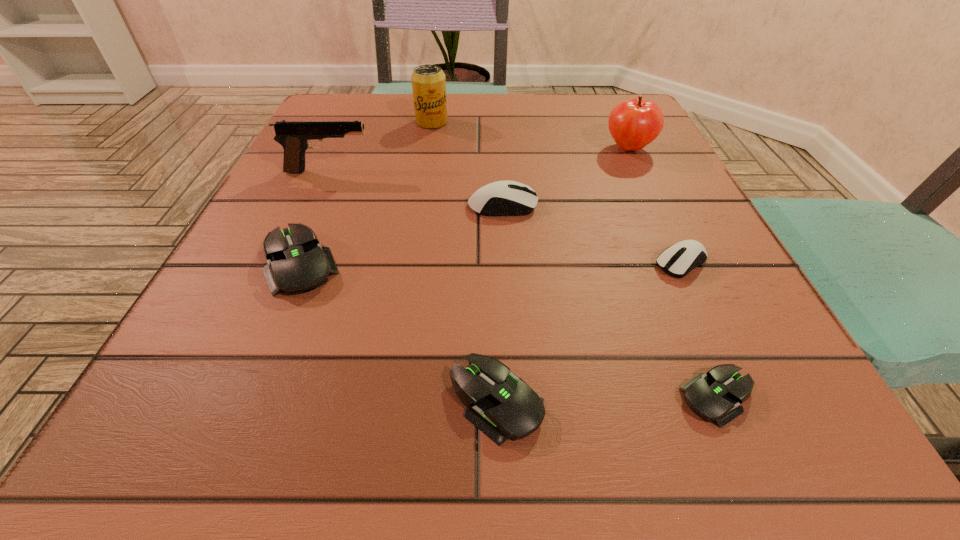
Locate an element on the screen. the nearer white mouse is located at coordinates (679, 259).

Identify the location of the smaller white mouse. (679, 259).

Where is `the second biggest gray computer mouse`? the second biggest gray computer mouse is located at coordinates pyautogui.click(x=504, y=406).

The width and height of the screenshot is (960, 540). I want to click on the shortest computer mouse, so click(715, 395).

Where is `the smallest gray computer mouse`? The height and width of the screenshot is (540, 960). the smallest gray computer mouse is located at coordinates (715, 395).

You are a GUI agent. You are given a task and a screenshot of the screen. Output one action in this format:
    pyautogui.click(x=<x>, y=<y>)
    Task: Click on the vacant space located 0.210m on the left of the farthest object
    This screenshot has height=540, width=960.
    Given the screenshot: What is the action you would take?
    pyautogui.click(x=322, y=122)

At what (x,y) coordinates should I click in order to perform the action: click on free spot located 0.240m on the front of the apple. Please return your answer as a coordinate pair (x, y). The image size is (960, 540). Looking at the image, I should click on (673, 241).

Where is `vacant space situated at the muzzle of the black pistol`? Image resolution: width=960 pixels, height=540 pixels. vacant space situated at the muzzle of the black pistol is located at coordinates (445, 171).

You are a GUI agent. You are given a task and a screenshot of the screen. Output one action in this format:
    pyautogui.click(x=<x>, y=<y>)
    Task: Click on the vacant space located on the left of the left white mouse
    This screenshot has width=960, height=540.
    Given the screenshot: What is the action you would take?
    [x=382, y=206]

The width and height of the screenshot is (960, 540). In order to click on free location located on the right of the biggest gray computer mouse in this screenshot , I will do `click(376, 264)`.